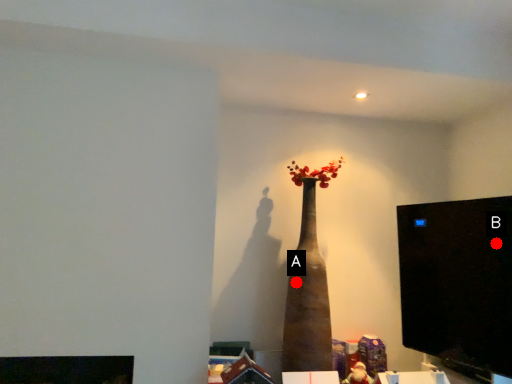
Question: Two points are circled on the image, labeled by A and B beside each circle. Which point is farther from the camera taking this photo?

Choices:
 (A) A is further
 (B) B is further

Answer: (A)